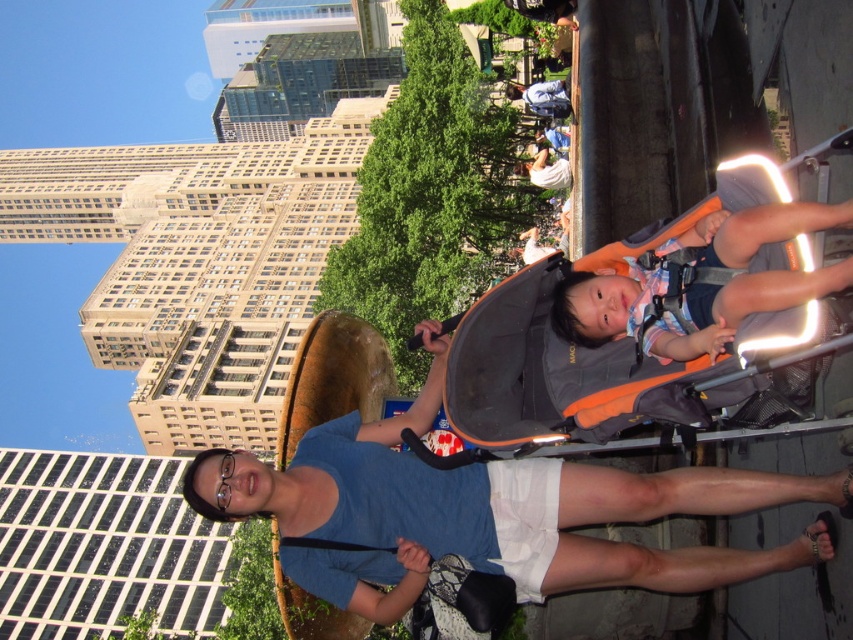
Question: Is blue fabric shirt at center above matte orange baby carrier at center?

Choices:
 (A) yes
 (B) no

Answer: (B)

Question: Which point is farther to the camera?

Choices:
 (A) orange fabric baby carriage at center
 (B) matte orange baby carrier at center

Answer: (A)

Question: Which of the following is the farthest from the observer?

Choices:
 (A) blue fabric shirt at center
 (B) orange fabric baby carriage at center

Answer: (B)

Question: Can you confirm if blue fabric shirt at center is positioned above orange fabric baby carriage at center?

Choices:
 (A) yes
 (B) no

Answer: (B)

Question: Considering the real-world distances, which object is farthest from the orange fabric baby carriage at center?

Choices:
 (A) blue fabric shirt at center
 (B) matte orange baby carrier at center

Answer: (A)

Question: Does blue fabric shirt at center have a lesser width compared to orange fabric baby carriage at center?

Choices:
 (A) no
 (B) yes

Answer: (A)